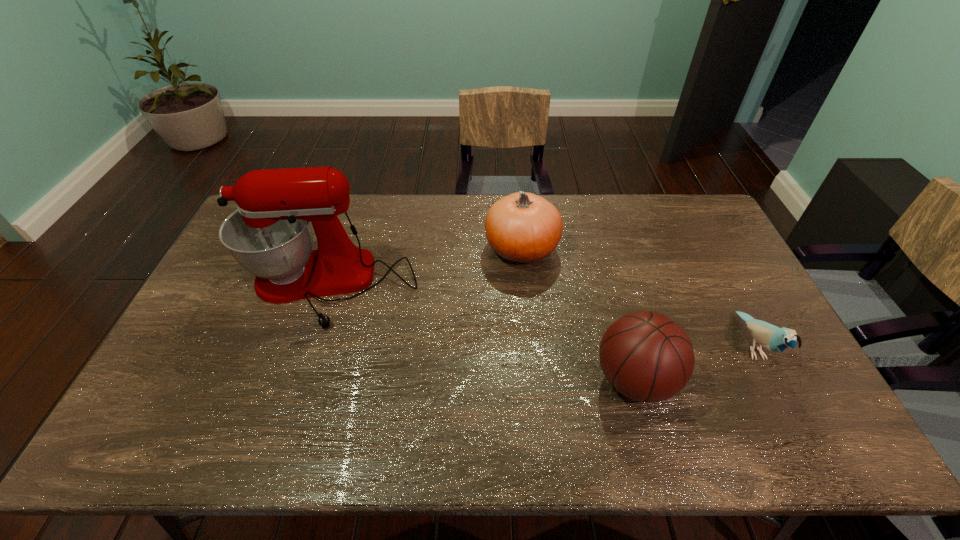
Where is `the leftmost object`? This screenshot has width=960, height=540. the leftmost object is located at coordinates (269, 235).

You are a GUI agent. You are given a task and a screenshot of the screen. Output one action in this format:
    pyautogui.click(x=<x>, y=<y>)
    Task: Click on the tallest object
    The width and height of the screenshot is (960, 540).
    Given the screenshot: What is the action you would take?
    pyautogui.click(x=269, y=235)

Locate an element on the screen. The height and width of the screenshot is (540, 960). the third object from right to left is located at coordinates (522, 227).

Where is `basketball`? The image size is (960, 540). basketball is located at coordinates (646, 356).

Where is `bird`? bird is located at coordinates (773, 338).

Image resolution: width=960 pixels, height=540 pixels. I want to click on the shortest object, so click(773, 338).

Identify the location of vacant space located 0.310m on the bowl side of the mixer. (279, 436).

I want to click on free space located on the left of the pumpkin, so click(401, 249).

Where is `vacant position located 0.210m on the right of the basketball`? This screenshot has height=540, width=960. vacant position located 0.210m on the right of the basketball is located at coordinates (757, 380).

Where is `blank space located 0.100m at the face of the shortest object`? The height and width of the screenshot is (540, 960). blank space located 0.100m at the face of the shortest object is located at coordinates (790, 418).